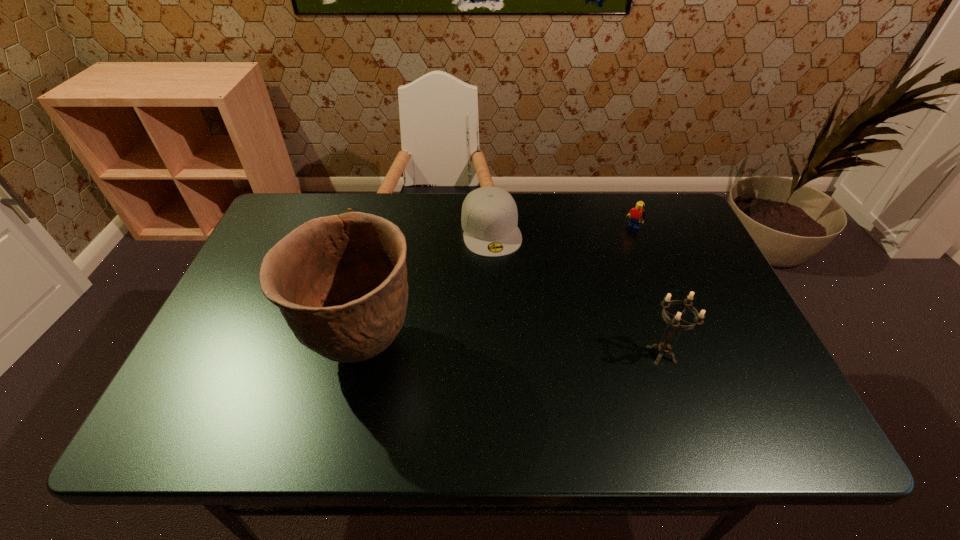
Identify the location of free space at the far left corner of the desktop. The width and height of the screenshot is (960, 540). point(286,227).

Identify the location of free space between the sunglasses and the candle holder. This screenshot has height=540, width=960. (499, 294).

Find the location of a particular element. This screenshot has height=540, width=960. free space between the Lego and the third object from left to right is located at coordinates click(563, 230).

You are a GUI agent. You are given a task and a screenshot of the screen. Output one action in this format:
    pyautogui.click(x=<x>, y=<y>)
    Task: Click on the free spot between the fourth shortest object and the cap
    
    Given the screenshot: What is the action you would take?
    pyautogui.click(x=576, y=292)

You are a GUI agent. You are given a task and a screenshot of the screen. Output one action in this format:
    pyautogui.click(x=<x>, y=<y>)
    Task: Click on the vacant area that lies between the fourth shortest object and the Lego
    This screenshot has height=540, width=960.
    Given the screenshot: What is the action you would take?
    pyautogui.click(x=648, y=293)

Identify the location of blank region between the fourth tallest object and the shortest object. (414, 232).

This screenshot has height=540, width=960. Identify the location of free space between the tallest object and the third tallest object. (498, 288).

The width and height of the screenshot is (960, 540). In order to click on empty space that is in between the cap and the Lego in this screenshot , I will do `click(563, 230)`.

The width and height of the screenshot is (960, 540). I want to click on object that is the fourth closest to the second shortest object, so click(x=664, y=347).

The width and height of the screenshot is (960, 540). I want to click on object that stands as the third closest to the Lego, so click(340, 282).